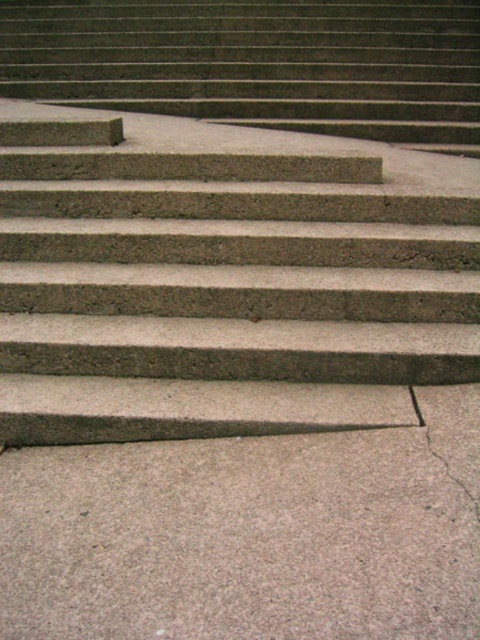
Who is shorter, concrete/stone stairs at center or concrete/stone steps at upper left?

Standing shorter between the two is concrete/stone steps at upper left.

Who is lower down, concrete/stone stairs at center or concrete/stone steps at upper left?

Positioned lower is concrete/stone stairs at center.

I want to click on concrete/stone stairs at center, so click(x=223, y=280).